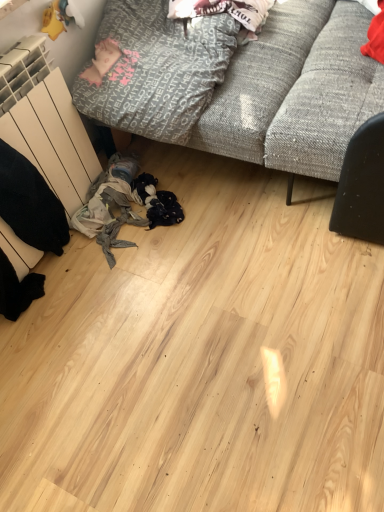
Question: Could textured gray couch at upper center be considered to be inside white cotton t-shirt at upper center, which appears as the second clothing when ordered from the bottom?

Choices:
 (A) yes
 (B) no

Answer: (B)

Question: Does white cotton t-shirt at upper center, the first clothing positioned from the top, appear on the right side of textured gray couch at upper center?

Choices:
 (A) no
 (B) yes

Answer: (A)

Question: Does white cotton t-shirt at upper center, which appears as the second clothing when ordered from the bottom, touch textured gray couch at upper center?

Choices:
 (A) no
 (B) yes

Answer: (A)

Question: From the image's perspective, is white cotton t-shirt at upper center, which appears as the second clothing when ordered from the bottom, beneath textured gray couch at upper center?

Choices:
 (A) no
 (B) yes

Answer: (A)

Question: Is white cotton t-shirt at upper center, which appears as the second clothing when ordered from the bottom, in front of textured gray couch at upper center?

Choices:
 (A) no
 (B) yes

Answer: (A)

Question: From a real-world perspective, is white cotton t-shirt at upper center, the first clothing positioned from the top, on textured gray couch at upper center?

Choices:
 (A) no
 (B) yes

Answer: (B)

Question: Is white cotton t-shirt at upper center, the first clothing positioned from the top, a part of textured gray couch at upper center?

Choices:
 (A) yes
 (B) no

Answer: (A)

Question: Considering the relative sizes of textured gray couch at upper center and white cotton t-shirt at upper center, which appears as the second clothing when ordered from the bottom, in the image provided, is textured gray couch at upper center bigger than white cotton t-shirt at upper center, which appears as the second clothing when ordered from the bottom,?

Choices:
 (A) no
 (B) yes

Answer: (B)

Question: From the image's perspective, is textured gray couch at upper center below white cotton t-shirt at upper center, which appears as the second clothing when ordered from the bottom?

Choices:
 (A) yes
 (B) no

Answer: (A)

Question: From a real-world perspective, is textured gray couch at upper center located beneath white cotton t-shirt at upper center, which appears as the second clothing when ordered from the bottom?

Choices:
 (A) yes
 (B) no

Answer: (A)

Question: Would you consider textured gray couch at upper center to be distant from white cotton t-shirt at upper center, which appears as the second clothing when ordered from the bottom?

Choices:
 (A) yes
 (B) no

Answer: (B)

Question: Does textured gray couch at upper center turn towards white cotton t-shirt at upper center, the first clothing positioned from the top?

Choices:
 (A) yes
 (B) no

Answer: (B)

Question: Considering the relative positions of textured gray couch at upper center and textured gray blanket at upper left, which appears as the first clothing when ordered from the bottom, in the image provided, is textured gray couch at upper center to the right of textured gray blanket at upper left, which appears as the first clothing when ordered from the bottom, from the viewer's perspective?

Choices:
 (A) yes
 (B) no

Answer: (A)